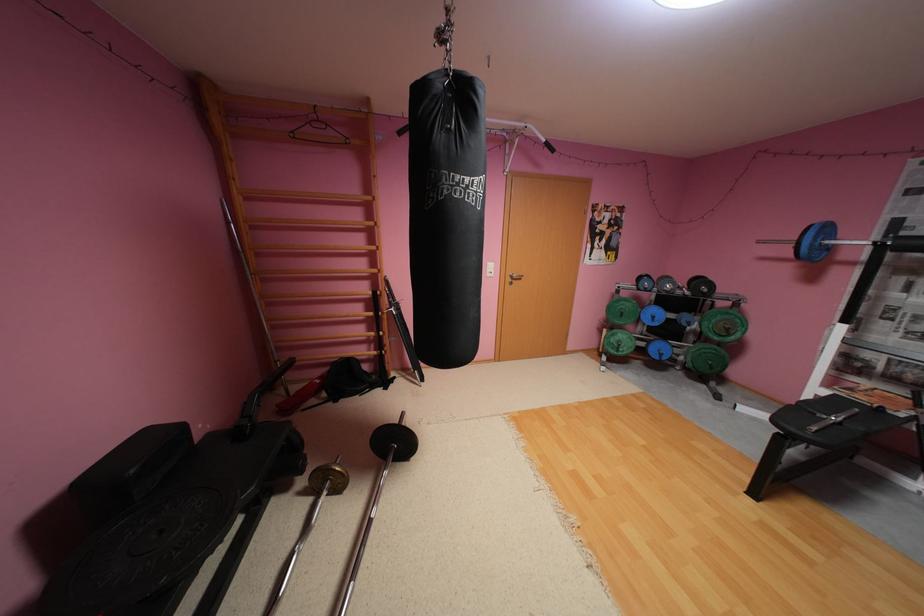
Describe the element at coordinates (824, 432) in the screenshot. Image resolution: width=924 pixels, height=616 pixels. I see `the black bench surface` at that location.